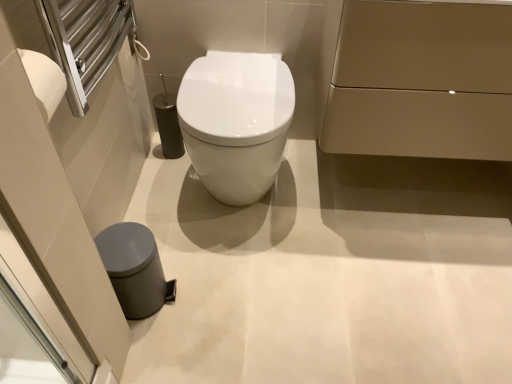
The width and height of the screenshot is (512, 384). What are the coordinates of `vacant space situated above gray matte trash can at lower left, which is the 1th porcelain from bottom to top (from a real-world perspective)` in the screenshot? It's located at (123, 241).